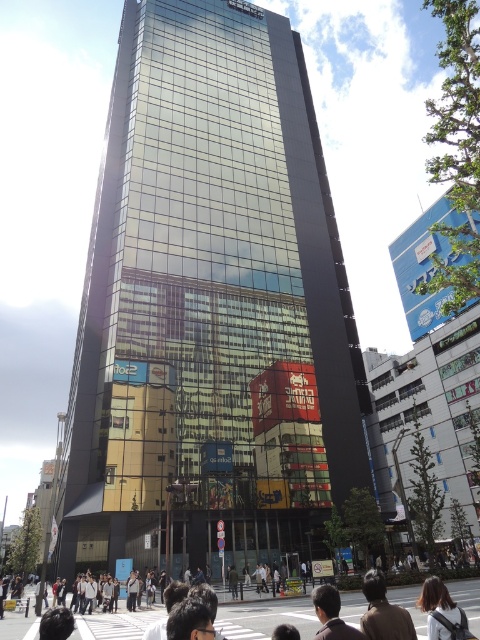
Looking at this image, is glassy metallic skyscraper at center to the right of brown leather jacket at lower center from the viewer's perspective?

Incorrect, glassy metallic skyscraper at center is not on the right side of brown leather jacket at lower center.

Where is `glassy metallic skyscraper at center`? The height and width of the screenshot is (640, 480). glassy metallic skyscraper at center is located at coordinates (210, 305).

Who is taller, glassy metallic skyscraper at center or brown hair at lower right?

Standing taller between the two is glassy metallic skyscraper at center.

Where is `glassy metallic skyscraper at center`? This screenshot has height=640, width=480. glassy metallic skyscraper at center is located at coordinates (210, 305).

Identify the location of glassy metallic skyscraper at center. This screenshot has height=640, width=480. (210, 305).

Can you confirm if brown hair at lower right is smaller than dark brown hair at lower center?

Actually, brown hair at lower right might be larger than dark brown hair at lower center.

Does brown hair at lower right have a greater height compared to dark brown hair at lower center?

Yes, brown hair at lower right is taller than dark brown hair at lower center.

Which is behind, point (427, 604) or point (314, 637)?

The point (427, 604) is behind.

Locate an element on the screen. brown hair at lower right is located at coordinates (442, 611).